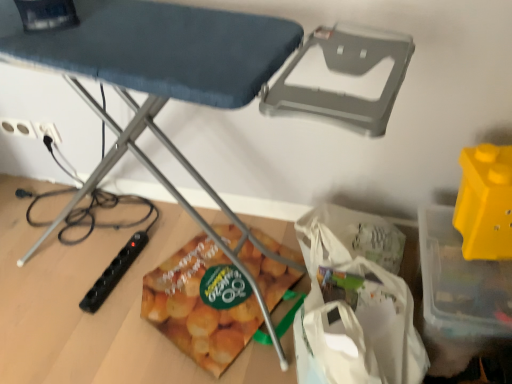
Locate an element on the screen. The height and width of the screenshot is (384, 512). free location in front of black plastic power strip at lower left, positioned as the first toy in back-to-front order is located at coordinates (105, 325).